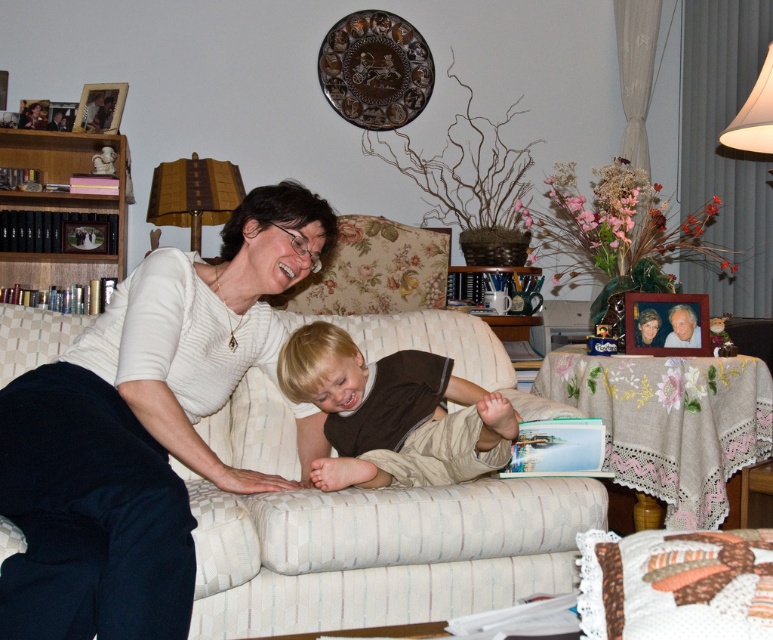
You are a photographer setting up a shoot in this living room. You need to place a small stool between the blonde hair boy at center and the wooden books at left. According to the scene description, where should you place the stool?

The stool should be placed between the blonde hair boy at center and the wooden books at left, closer to the wooden books at left since the blonde hair boy at center is positioned on the right side of the wooden books at left.

You are a photographer setting up a shoot in this living room. You need to place a small prop between the white matte sweater at center and the wooden books at left. Based on their positions, where should you place the prop?

The white matte sweater at center is to the right of the wooden books at left, so you should place the prop between them by positioning it to the right of the wooden books at left and to the left of the white matte sweater at center.